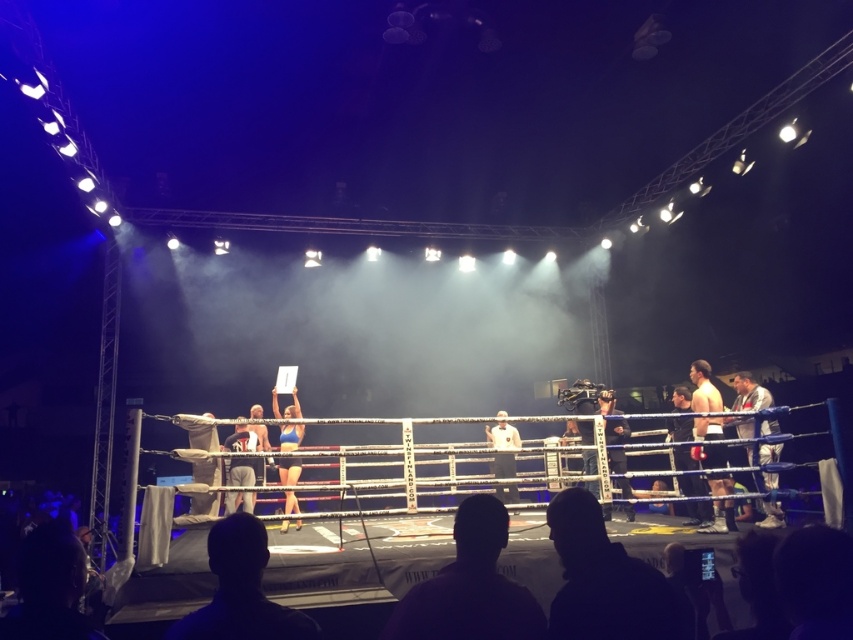
Can you confirm if muscular tan skin at center is thinner than light brown leather jacket at right?

Yes, muscular tan skin at center is thinner than light brown leather jacket at right.

Who is shorter, muscular tan skin at center or light brown leather jacket at right?

light brown leather jacket at right is shorter.

Image resolution: width=853 pixels, height=640 pixels. In order to click on muscular tan skin at center in this screenshot , I will do 703,388.

The height and width of the screenshot is (640, 853). I want to click on muscular tan skin at center, so click(x=703, y=388).

Which is below, muscular tan skin at center or blue fabric shorts at center?

Positioned lower is blue fabric shorts at center.

Does muscular tan skin at center have a lesser height compared to blue fabric shorts at center?

Yes, muscular tan skin at center is shorter than blue fabric shorts at center.

Is point (712, 449) farther from camera compared to point (291, 468)?

No, (712, 449) is in front of (291, 468).

Identify the location of muscular tan skin at center. (703, 388).

Describe the element at coordinates (606, 580) in the screenshot. I see `silhouette leather jacket at lower right` at that location.

Image resolution: width=853 pixels, height=640 pixels. I want to click on silhouette leather jacket at lower right, so click(606, 580).

Where is `silhouette leather jacket at lower right`? silhouette leather jacket at lower right is located at coordinates (606, 580).